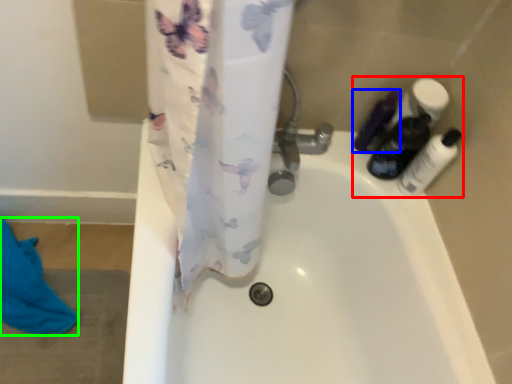
Question: Which object is the closest to the toiletry (highlighted by a red box)? Choose among these: toiletry (highlighted by a blue box) or beach towel (highlighted by a green box).

Choices:
 (A) toiletry
 (B) beach towel

Answer: (A)